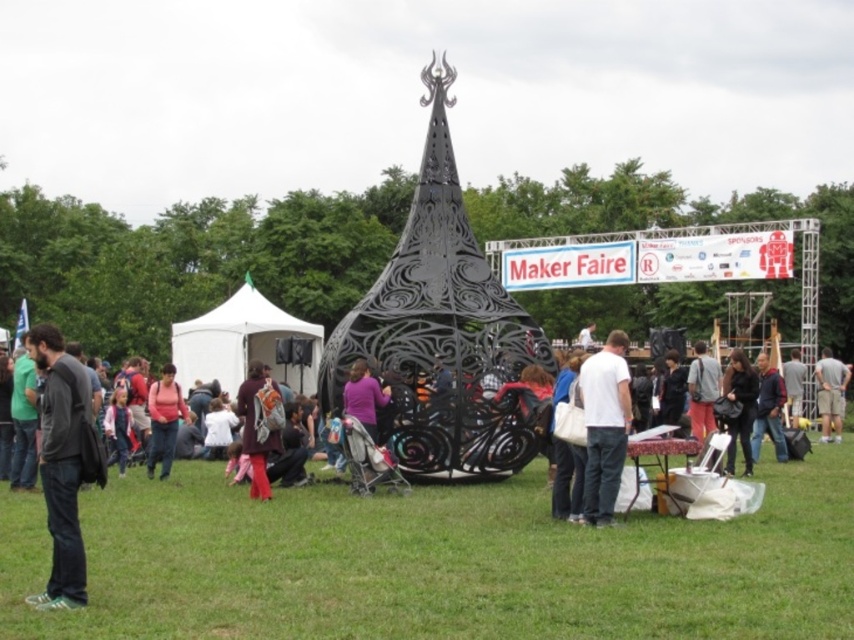
Question: Which point is closer to the camera?

Choices:
 (A) (41, 456)
 (B) (240, 417)

Answer: (A)

Question: Which object appears farthest from the camera in this image?

Choices:
 (A) white matte shirt at center
 (B) denim jacket at center
 (C) light brown leather jacket at center

Answer: (C)

Question: Can you confirm if velvet purple dress at center is thinner than matte black jacket at center?

Choices:
 (A) no
 (B) yes

Answer: (A)

Question: In this image, where is white matte shirt at center located relative to dark blue jeans at center?

Choices:
 (A) left
 (B) right

Answer: (A)

Question: Which object is the closest to the white fabric tent at center?

Choices:
 (A) dark blue jeans at center
 (B) light brown leather jacket at center
 (C) gray fabric pants at lower right

Answer: (A)

Question: Is green grass at center smaller than dark gray jacket at left?

Choices:
 (A) yes
 (B) no

Answer: (B)